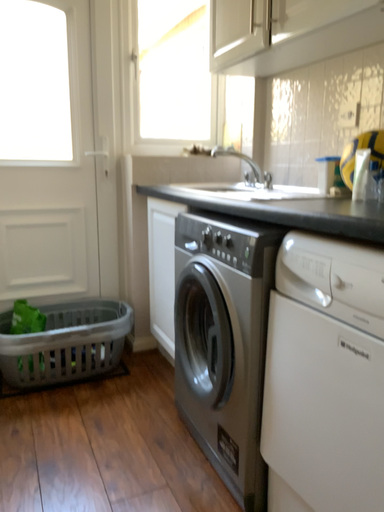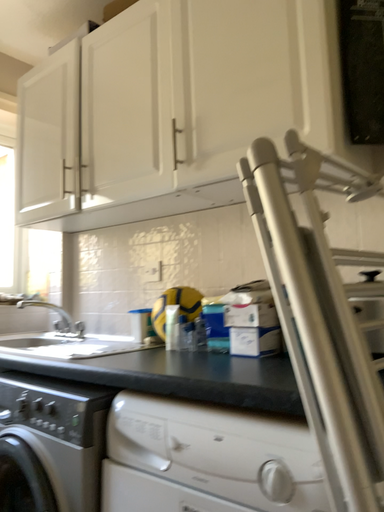
Question: How did the camera likely rotate when shooting the video?

Choices:
 (A) rotated left
 (B) rotated right

Answer: (B)